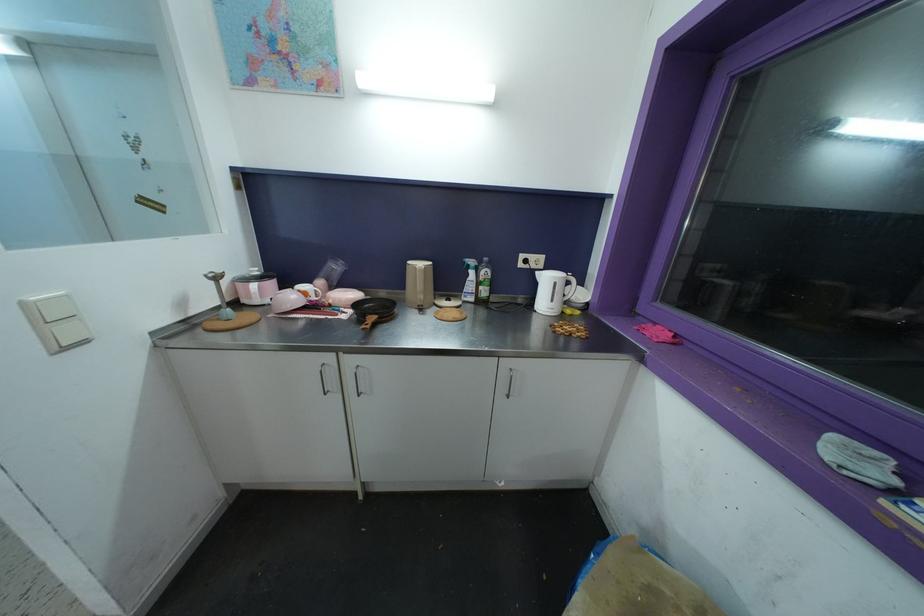
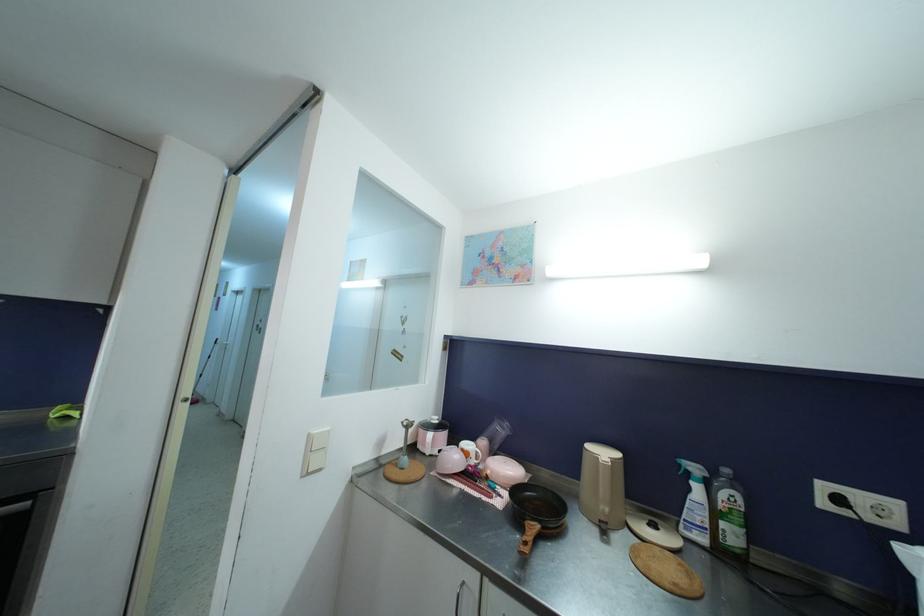
Locate, in the second image, the point that corresponds to (433,265) in the first image.

(623, 458)